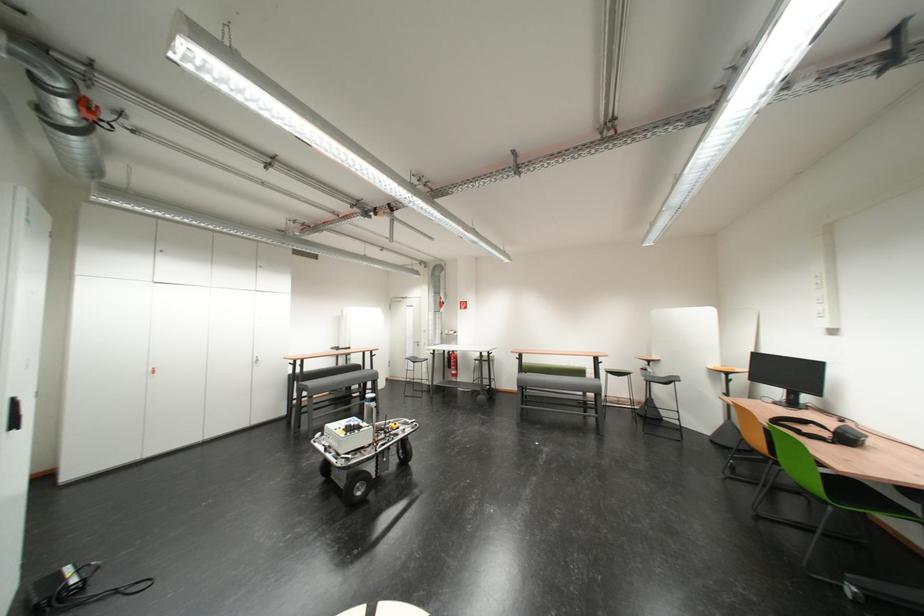
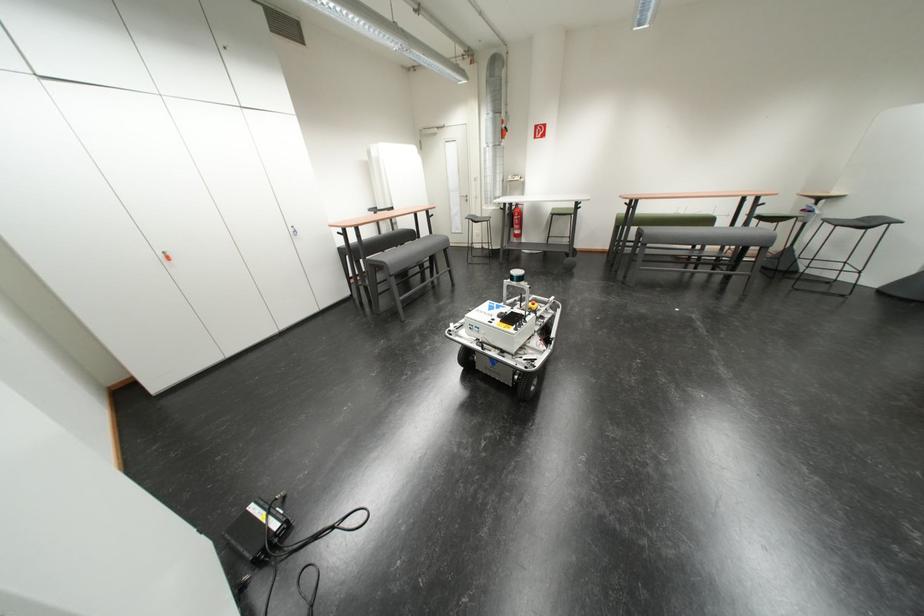
The point at (90,573) is marked in the first image. Where is the corresponding point in the second image?

(281, 516)